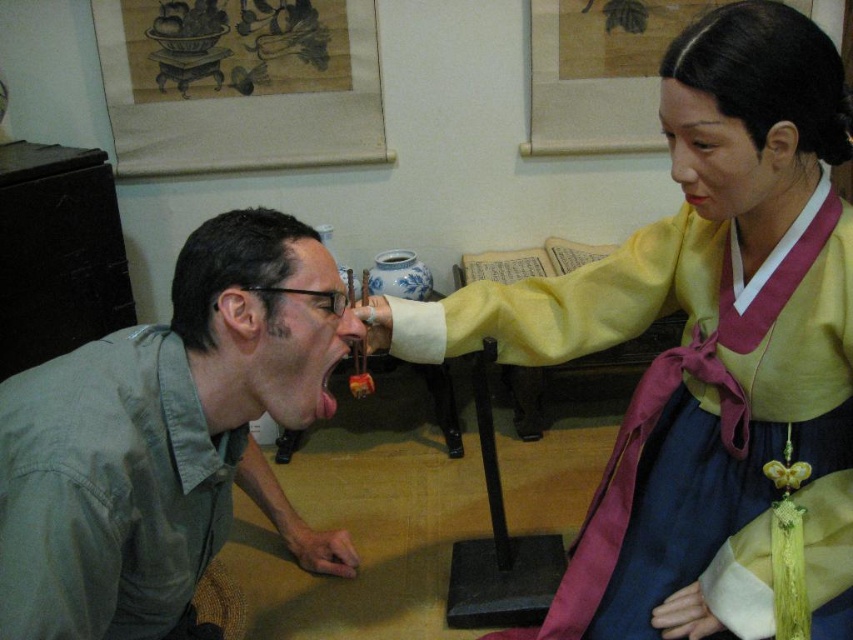
You are a photographer trying to capture a clear photo of both the green matte shirt at lower left and the green cotton shirt at lower left. However, you notice one is blocking the other. Which shirt is currently hiding part of the other?

The green cotton shirt at lower left is behind the green matte shirt at lower left, so the green matte shirt at lower left is hiding part of the green cotton shirt at lower left.

You are a fashion designer observing two green shirts in a traditional Korean setting. The green matte shirt at lower left and the green cotton shirt at lower left are both present. Which one is taller?

The green matte shirt at lower left is taller than the green cotton shirt at lower left.